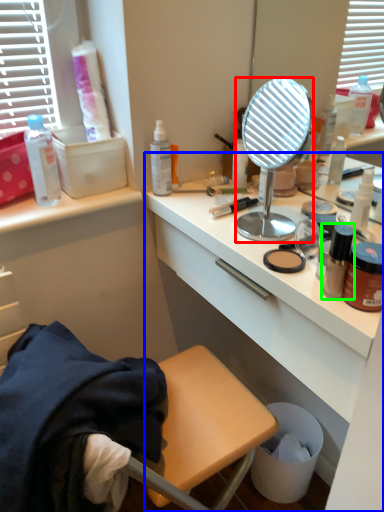
Question: Based on their relative distances, which object is nearer to mirror (highlighted by a red box)? Choose from desk (highlighted by a blue box) and bottle (highlighted by a green box).

Choices:
 (A) desk
 (B) bottle

Answer: (A)